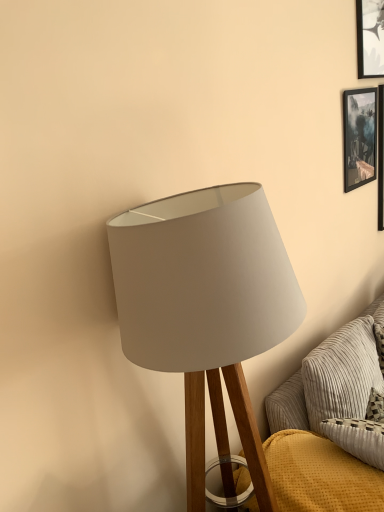
Question: In terms of width, does white fabric lampshade at center look wider or thinner when compared to textured gray couch at lower right?

Choices:
 (A) wide
 (B) thin

Answer: (A)

Question: From the image's perspective, relative to textured gray couch at lower right, is white fabric lampshade at center above or below?

Choices:
 (A) below
 (B) above

Answer: (B)

Question: Considering the real-world distances, which object is closest to the textured gray couch at lower right?

Choices:
 (A) black glossy picture frame at upper right
 (B) white fabric lampshade at center

Answer: (B)

Question: Estimate the real-world distances between objects in this image. Which object is farther from the textured gray couch at lower right?

Choices:
 (A) black glossy picture frame at upper right
 (B) white fabric lampshade at center

Answer: (A)